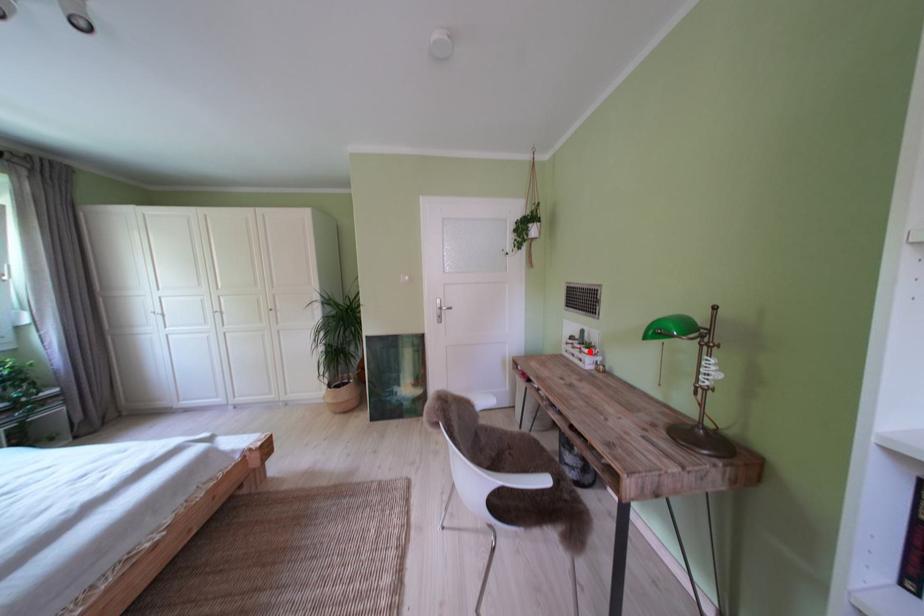
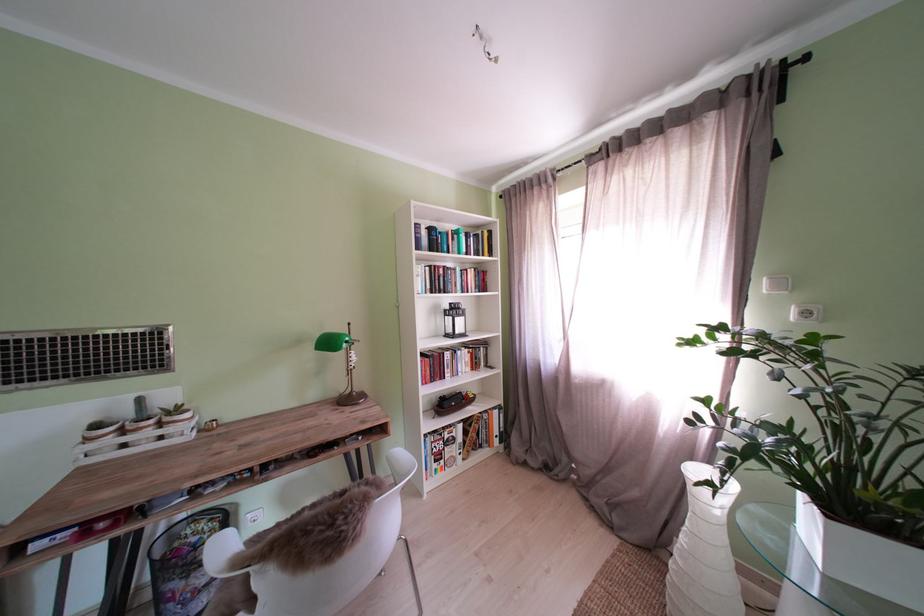
In the second image, find the point that corresponds to the highlighted location in the first image.

(163, 427)